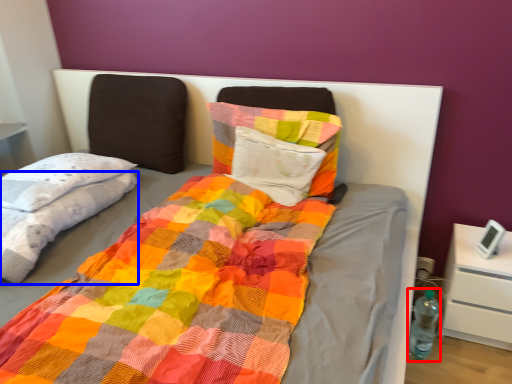
Question: Which object appears farthest to the camera in this image, bottle (highlighted by a red box) or blanket (highlighted by a blue box)?

Choices:
 (A) bottle
 (B) blanket

Answer: (A)